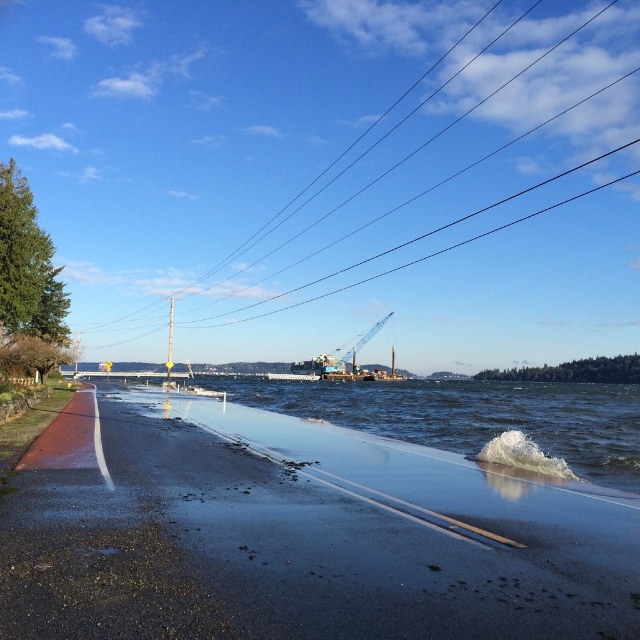
Question: Among these objects, which one is nearest to the camera?

Choices:
 (A) shiny asphalt road at lower left
 (B) metallic blue crane at center
 (C) black wire at upper center

Answer: (A)

Question: Is black wire at upper center thinner than metallic blue crane at center?

Choices:
 (A) no
 (B) yes

Answer: (A)

Question: Does black wire at upper center appear over shiny asphalt road at lower left?

Choices:
 (A) no
 (B) yes

Answer: (B)

Question: Which of the following is the farthest from the observer?

Choices:
 (A) (356, 346)
 (B) (632, 540)
 (C) (600, 342)

Answer: (C)

Question: Among these objects, which one is nearest to the camera?

Choices:
 (A) shiny asphalt road at lower left
 (B) black wire at upper center
 (C) metallic blue crane at center

Answer: (A)

Question: Is the position of shiny asphalt road at lower left more distant than that of metallic blue crane at center?

Choices:
 (A) yes
 (B) no

Answer: (B)